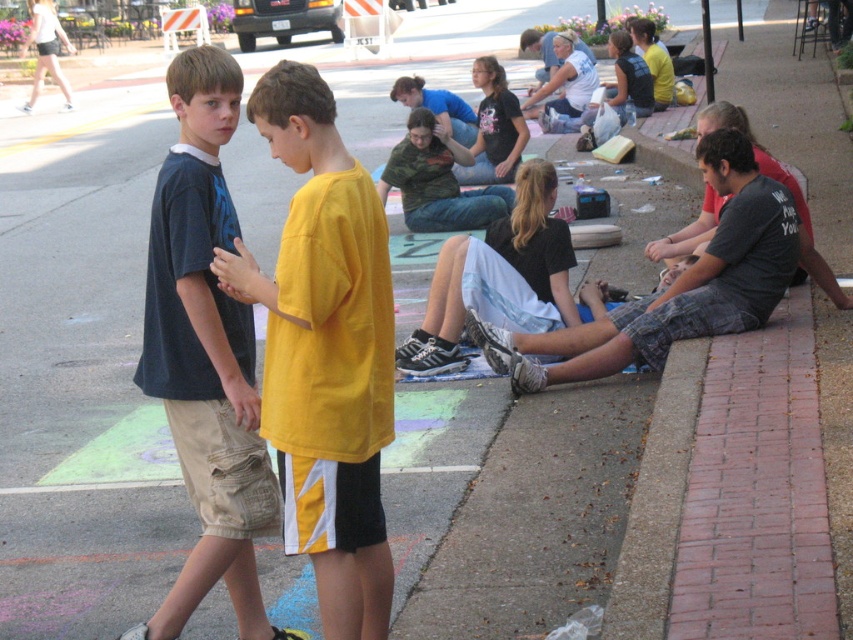
Question: Which is nearer to the camouflage shirt at center?

Choices:
 (A) dark blue t-shirt at left
 (B) yellow matte shirt at center

Answer: (A)

Question: Which of the following is the farthest from the observer?

Choices:
 (A) dark blue t-shirt at left
 (B) camouflage shirt at center
 (C) yellow matte shirt at center

Answer: (B)

Question: Among these points, which one is nearest to the camera?

Choices:
 (A) (471, 161)
 (B) (183, 460)
 (C) (363, 611)

Answer: (C)

Question: Considering the relative positions of yellow matte shirt at center and camouflage shirt at center in the image provided, where is yellow matte shirt at center located with respect to camouflage shirt at center?

Choices:
 (A) above
 (B) below

Answer: (B)

Question: In this image, where is dark blue t-shirt at left located relative to camouflage shirt at center?

Choices:
 (A) above
 (B) below

Answer: (B)

Question: Is dark blue t-shirt at left wider than camouflage shirt at center?

Choices:
 (A) no
 (B) yes

Answer: (A)